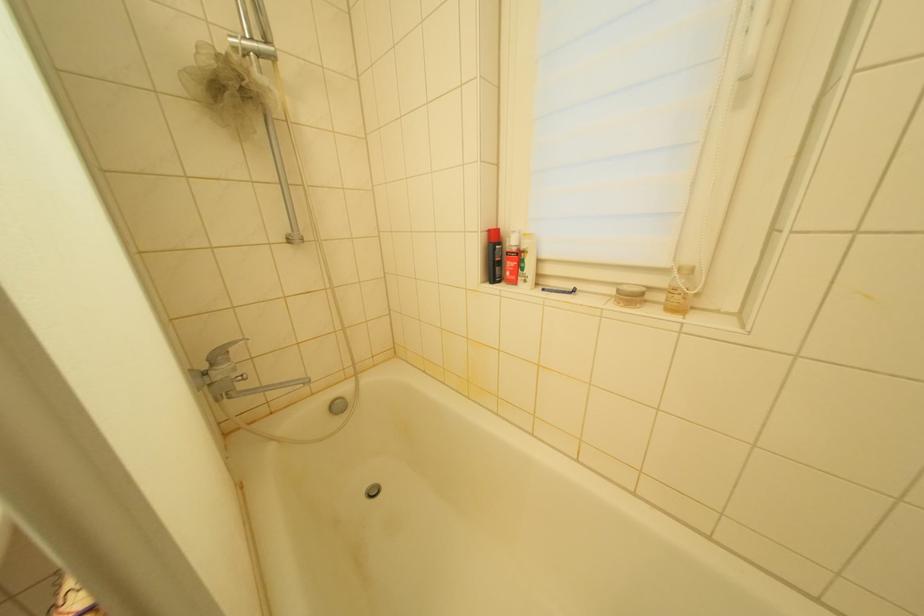
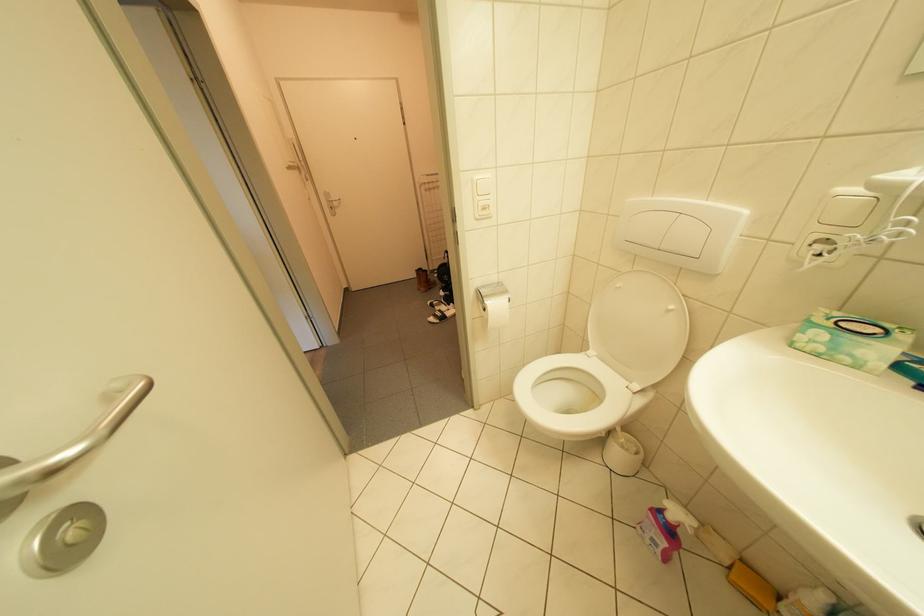
Based on the continuous images, in which direction is the camera rotating?

The camera rotated toward left-down.